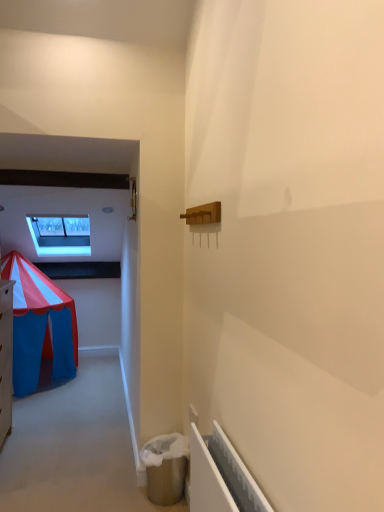
What is the approximate width of transparent glass window at upper left?

transparent glass window at upper left is 35.37 inches in width.

This screenshot has height=512, width=384. I want to click on transparent glass window at upper left, so click(x=60, y=234).

This screenshot has width=384, height=512. What do you see at coordinates (60, 234) in the screenshot?
I see `transparent glass window at upper left` at bounding box center [60, 234].

What is the approximate height of white plastic radiator at lower right?

The height of white plastic radiator at lower right is 14.84 inches.

Find the location of a particular element. white plastic radiator at lower right is located at coordinates (220, 476).

What do you see at coordinates (220, 476) in the screenshot? This screenshot has width=384, height=512. I see `white plastic radiator at lower right` at bounding box center [220, 476].

Locate an element on the screen. transparent glass window at upper left is located at coordinates (60, 234).

Consider the image. Considering the relative positions of white plastic radiator at lower right and transparent glass window at upper left in the image provided, is white plastic radiator at lower right to the right of transparent glass window at upper left from the viewer's perspective?

Yes, white plastic radiator at lower right is to the right of transparent glass window at upper left.

Which is behind, white plastic radiator at lower right or transparent glass window at upper left?

transparent glass window at upper left is behind.

Between point (200, 473) and point (64, 223), which one is positioned behind?

Positioned behind is point (64, 223).

From the image's perspective, does white plastic radiator at lower right appear lower than transparent glass window at upper left?

Yes.

Based on the photo, from a real-world perspective, does white plastic radiator at lower right stand above transparent glass window at upper left?

No, from a real-world perspective, white plastic radiator at lower right is not above transparent glass window at upper left.

Considering the sizes of objects white plastic radiator at lower right and transparent glass window at upper left in the image provided, who is thinner, white plastic radiator at lower right or transparent glass window at upper left?

white plastic radiator at lower right.

Considering the relative sizes of white plastic radiator at lower right and transparent glass window at upper left in the image provided, is white plastic radiator at lower right taller than transparent glass window at upper left?

Incorrect, the height of white plastic radiator at lower right is not larger of that of transparent glass window at upper left.

Does white plastic radiator at lower right have a larger size compared to transparent glass window at upper left?

No.

Is white plastic radiator at lower right inside or outside of transparent glass window at upper left?

white plastic radiator at lower right exists outside the volume of transparent glass window at upper left.

Are white plastic radiator at lower right and transparent glass window at upper left located far from each other?

white plastic radiator at lower right is far away from transparent glass window at upper left.

Is white plastic radiator at lower right aimed at transparent glass window at upper left?

No, white plastic radiator at lower right is not aimed at transparent glass window at upper left.

How different are the orientations of white plastic radiator at lower right and transparent glass window at upper left in degrees?

The angular difference between white plastic radiator at lower right and transparent glass window at upper left is 90 degrees.

How distant is white plastic radiator at lower right from transparent glass window at upper left?

A distance of 2.72 meters exists between white plastic radiator at lower right and transparent glass window at upper left.

This screenshot has width=384, height=512. I want to click on window lying on the left of white plastic radiator at lower right, so click(x=60, y=234).

In the image, is transparent glass window at upper left on the left side or the right side of white plastic radiator at lower right?

In the image, transparent glass window at upper left appears on the left side of white plastic radiator at lower right.

Which object is further away from the camera taking this photo, transparent glass window at upper left or white plastic radiator at lower right?

transparent glass window at upper left is further away from the camera.

Considering the positions of points (36, 246) and (234, 457), is point (36, 246) farther from camera compared to point (234, 457)?

Yes, it is behind point (234, 457).

From the image's perspective, which object appears higher, transparent glass window at upper left or white plastic radiator at lower right?

transparent glass window at upper left, from the image's perspective.

From a real-world perspective, between transparent glass window at upper left and white plastic radiator at lower right, who is vertically higher?

transparent glass window at upper left is physically above.

Considering the sizes of objects transparent glass window at upper left and white plastic radiator at lower right in the image provided, who is thinner, transparent glass window at upper left or white plastic radiator at lower right?

white plastic radiator at lower right is thinner.

Considering the relative sizes of transparent glass window at upper left and white plastic radiator at lower right in the image provided, is transparent glass window at upper left taller than white plastic radiator at lower right?

Yes.

Does transparent glass window at upper left have a smaller size compared to white plastic radiator at lower right?

No, transparent glass window at upper left is not smaller than white plastic radiator at lower right.

Do you think transparent glass window at upper left is within white plastic radiator at lower right, or outside of it?

The correct answer is: outside.

Can you see transparent glass window at upper left touching white plastic radiator at lower right?

There is a gap between transparent glass window at upper left and white plastic radiator at lower right.

Is transparent glass window at upper left facing away from white plastic radiator at lower right?

No, transparent glass window at upper left's orientation is not away from white plastic radiator at lower right.

What's the angular difference between transparent glass window at upper left and white plastic radiator at lower right's facing directions?

The angle between the facing direction of transparent glass window at upper left and the facing direction of white plastic radiator at lower right is 90 degrees.

Measure the distance from transparent glass window at upper left to white plastic radiator at lower right.

Answer: A distance of 2.72 meters exists between transparent glass window at upper left and white plastic radiator at lower right.

Locate an element on the screen. The image size is (384, 512). radiator on the right side of transparent glass window at upper left is located at coordinates (220, 476).

In the image, there is a white plastic radiator at lower right. Identify the location of window above it (from the image's perspective). The height and width of the screenshot is (512, 384). pos(60,234).

Locate an element on the screen. The height and width of the screenshot is (512, 384). radiator on the right of transparent glass window at upper left is located at coordinates (220, 476).